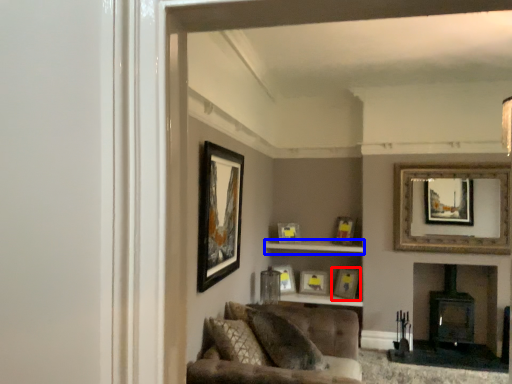
Question: Which of the following is the closest to the observer, picture frame (highlighted by a red box) or cabinet (highlighted by a blue box)?

Choices:
 (A) picture frame
 (B) cabinet

Answer: (B)